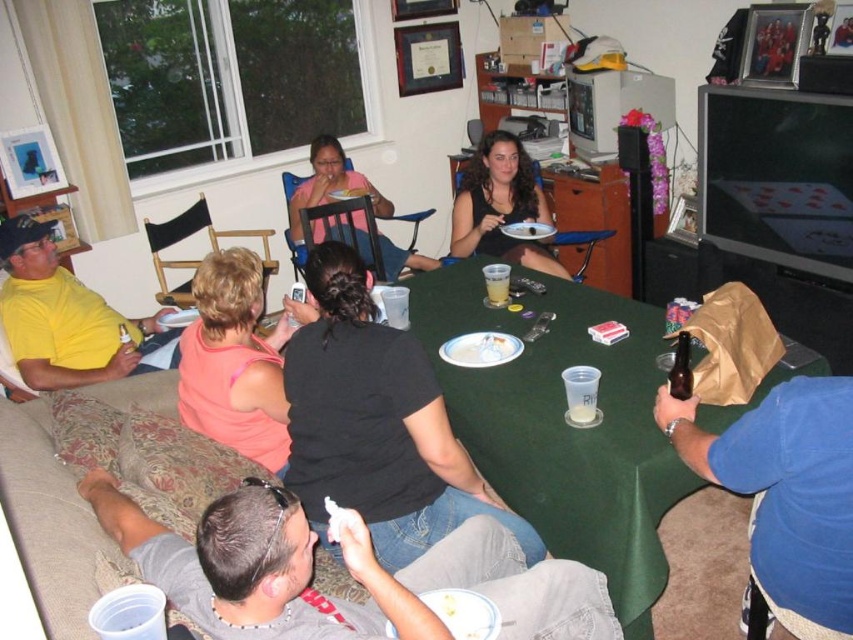
You are planning to place a small decorative item on the gray fabric couch at lower left and the pink fabric shirt at center. Which object has more space available for placing the item?

The gray fabric couch at lower left might have more space available than the pink fabric shirt at center since it is wider.

You are sitting on the gray fabric couch at lower left and want to pass a drink to the person wearing the black matte shirt at center. Which direction should you move to reach them?

The gray fabric couch at lower left is located below the black matte shirt at center, so you should move upward to reach them.